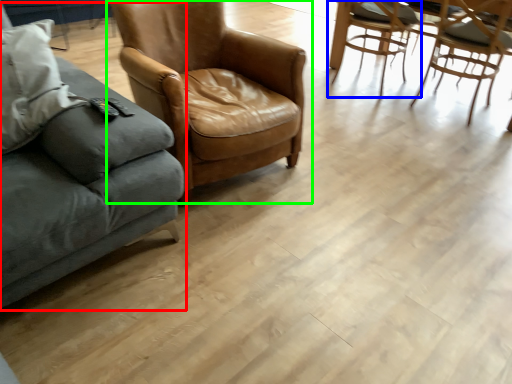
Question: Which is farther away from studio couch (highlighted by a red box)? chair (highlighted by a blue box) or chair (highlighted by a green box)?

Choices:
 (A) chair
 (B) chair

Answer: (A)